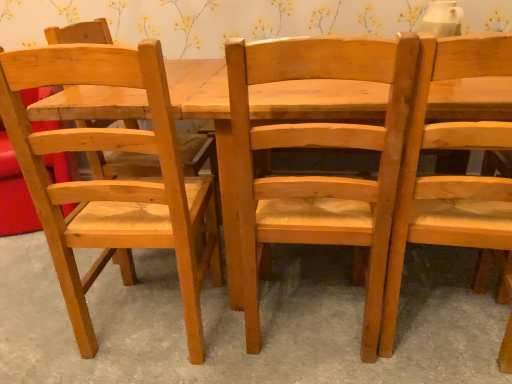
You are a GUI agent. You are given a task and a screenshot of the screen. Output one action in this format:
    pyautogui.click(x=<x>, y=<y>)
    Task: Click on the vacant space underneath natural wood chair at right, the 1th chair from the right (from a real-world perspective)
    This screenshot has height=384, width=512.
    Given the screenshot: What is the action you would take?
    pyautogui.click(x=440, y=319)